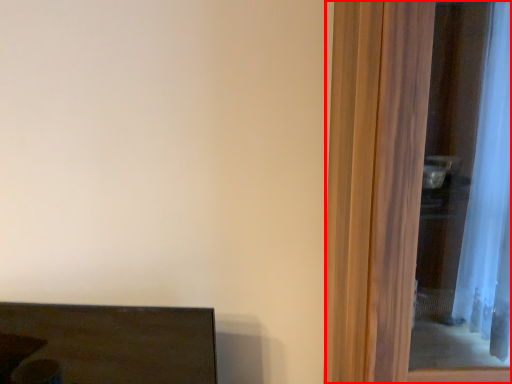
Question: Considering the relative positions of screen door (annotated by the red box) and furniture in the image provided, where is screen door (annotated by the red box) located with respect to the staircase?

Choices:
 (A) left
 (B) right

Answer: (B)